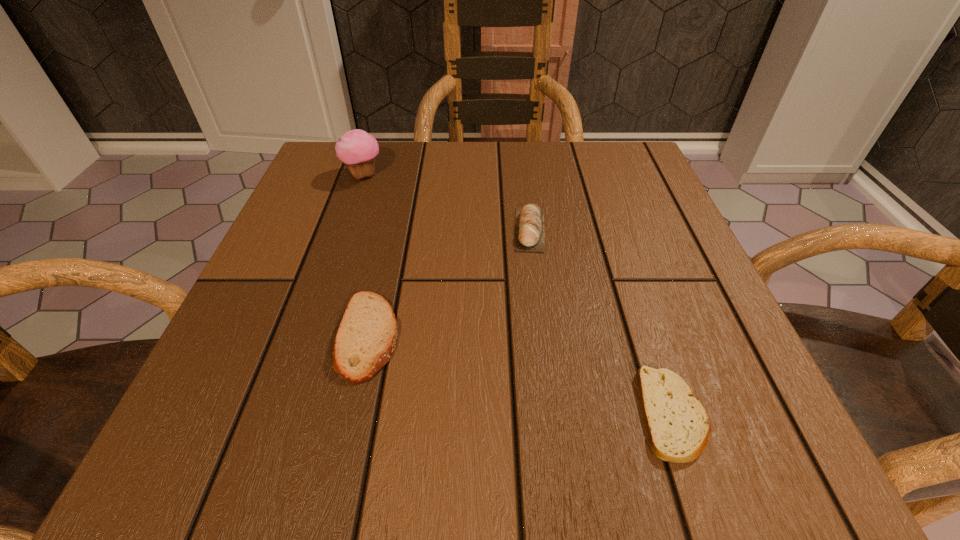
Identify the location of blank region between the tallest object and the shortest pita bread. click(517, 295).

Find the location of a particular element. This screenshot has height=540, width=960. vacant area that lies between the shortest object and the leftmost pita bread is located at coordinates (520, 375).

Locate an element on the screen. empty space between the tallest object and the leftmost pita bread is located at coordinates (366, 255).

This screenshot has width=960, height=540. In order to click on object that ranks as the third closest to the third nearest object in this screenshot , I will do coord(356,148).

Choose which object is the third nearest neighbor to the leftmost pita bread. Please provide its 2D coordinates. Your answer should be formatted as a tuple, i.e. [(x, y)], where the tuple contains the x and y coordinates of a point satisfying the conditions above.

[(677, 424)]

The height and width of the screenshot is (540, 960). Find the location of `pita bread that is the second closest to the second object from right to left`. pita bread that is the second closest to the second object from right to left is located at coordinates (677, 424).

Identify which pita bread is the closest to the shortest pita bread. Please provide its 2D coordinates. Your answer should be formatted as a tuple, i.e. [(x, y)], where the tuple contains the x and y coordinates of a point satisfying the conditions above.

[(529, 228)]

Find the location of `vacant area that satisfies the following two spatial constraints: 1. on the front side of the farthest object; 2. on the right side of the second shortest object`. vacant area that satisfies the following two spatial constraints: 1. on the front side of the farthest object; 2. on the right side of the second shortest object is located at coordinates (307, 336).

Find the location of `free spot that satisfies the following two spatial constraints: 1. on the back side of the farthest pita bread; 2. on the right side of the third object from right to left`. free spot that satisfies the following two spatial constraints: 1. on the back side of the farthest pita bread; 2. on the right side of the third object from right to left is located at coordinates (393, 229).